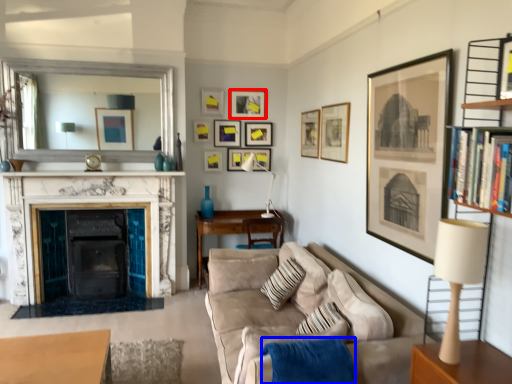
Question: Which object is further to the camera taking this photo, picture frame (highlighted by a red box) or blanket (highlighted by a blue box)?

Choices:
 (A) picture frame
 (B) blanket

Answer: (A)